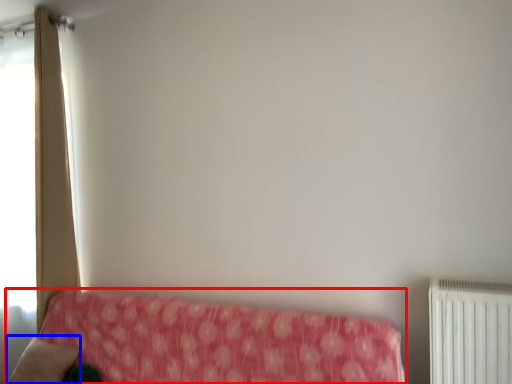
Question: Which object is closer to the camera taking this photo, furniture (highlighted by a red box) or pillow (highlighted by a blue box)?

Choices:
 (A) furniture
 (B) pillow

Answer: (A)